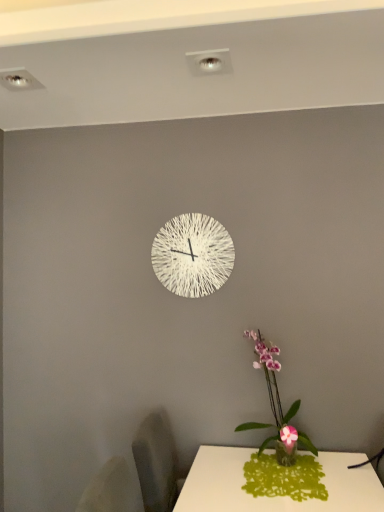
From the picture: Measure the distance between point [297,432] and camera.

Point [297,432] and camera are 6.85 feet apart.

The height and width of the screenshot is (512, 384). Describe the element at coordinates (277, 405) in the screenshot. I see `pink orchid at lower right` at that location.

Where is `pink orchid at lower right`? The image size is (384, 512). pink orchid at lower right is located at coordinates (277, 405).

Measure the distance between white textured clock at center and camera.

white textured clock at center and camera are 7.32 feet apart.

You are a GUI agent. You are given a task and a screenshot of the screen. Output one action in this format:
    pyautogui.click(x=<x>, y=<y>)
    Task: Click on the white textured clock at center
    Image resolution: width=384 pixels, height=512 pixels.
    Given the screenshot: What is the action you would take?
    pyautogui.click(x=192, y=255)

The width and height of the screenshot is (384, 512). What do you see at coordinates (192, 255) in the screenshot?
I see `white textured clock at center` at bounding box center [192, 255].

Identify the location of pink orchid at lower right. (277, 405).

Considering the relative positions of white textured clock at center and pink orchid at lower right in the image provided, is white textured clock at center to the left of pink orchid at lower right from the viewer's perspective?

Yes.

Which object is more forward, white textured clock at center or pink orchid at lower right?

Positioned in front is pink orchid at lower right.

Which point is more distant from viewer, (194, 284) or (300, 442)?

Positioned behind is point (194, 284).

From the image's perspective, is white textured clock at center on top of pink orchid at lower right?

Indeed, from the image's perspective, white textured clock at center is shown above pink orchid at lower right.

From a real-world perspective, which object rests below the other?

pink orchid at lower right is physically lower.

Does white textured clock at center have a greater width compared to pink orchid at lower right?

No.

From the picture: Is white textured clock at center taller than pink orchid at lower right?

No.

Considering the sizes of objects white textured clock at center and pink orchid at lower right in the image provided, who is bigger, white textured clock at center or pink orchid at lower right?

Bigger between the two is pink orchid at lower right.

Choose the correct answer: Is white textured clock at center inside pink orchid at lower right or outside it?

white textured clock at center is outside pink orchid at lower right.

Would you say white textured clock at center is a long distance from pink orchid at lower right?

white textured clock at center is actually quite close to pink orchid at lower right.

Is white textured clock at center looking in the opposite direction of pink orchid at lower right?

No, white textured clock at center's orientation is not away from pink orchid at lower right.

Based on the photo, how different are the orientations of white textured clock at center and pink orchid at lower right in degrees?

white textured clock at center and pink orchid at lower right are facing 0.00379 degrees away from each other.

Where is `houseplant that appears in front of the white textured clock at center`? houseplant that appears in front of the white textured clock at center is located at coordinates (277, 405).

Is pink orchid at lower right to the right of white textured clock at center from the viewer's perspective?

Correct, you'll find pink orchid at lower right to the right of white textured clock at center.

Which object is closer to the camera taking this photo, pink orchid at lower right or white textured clock at center?

Positioned in front is pink orchid at lower right.

Is point (289, 419) closer or farther from the camera than point (216, 257)?

Point (289, 419) is closer to the camera than point (216, 257).

From the image's perspective, is pink orchid at lower right located above or below white textured clock at center?

Clearly, from the image's perspective, pink orchid at lower right is below white textured clock at center.

From a real-world perspective, is pink orchid at lower right physically located above or below white textured clock at center?

From a real-world perspective, pink orchid at lower right is physically below white textured clock at center.

Which of these two, pink orchid at lower right or white textured clock at center, is thinner?

white textured clock at center.

From their relative heights in the image, would you say pink orchid at lower right is taller or shorter than white textured clock at center?

Considering their sizes, pink orchid at lower right has more height than white textured clock at center.

Can you confirm if pink orchid at lower right is smaller than white textured clock at center?

No, pink orchid at lower right is not smaller than white textured clock at center.

In the scene shown: Is white textured clock at center surrounded by pink orchid at lower right?

No, white textured clock at center is not a part of pink orchid at lower right.

Would you say pink orchid at lower right is a long distance from white textured clock at center?

They are positioned close to each other.

Is white textured clock at center at the back of pink orchid at lower right?

That's not correct — pink orchid at lower right is not looking away from white textured clock at center.

How different are the orientations of pink orchid at lower right and white textured clock at center in degrees?

The angle between the facing direction of pink orchid at lower right and the facing direction of white textured clock at center is 0.00379 degrees.

The width and height of the screenshot is (384, 512). I want to click on houseplant located below the white textured clock at center (from the image's perspective), so click(x=277, y=405).

Image resolution: width=384 pixels, height=512 pixels. What are the coordinates of `houseplant below the white textured clock at center (from the image's perspective)` in the screenshot? It's located at (277, 405).

Find the location of a particular element. wall clock that is above the pink orchid at lower right (from a real-world perspective) is located at coordinates (192, 255).